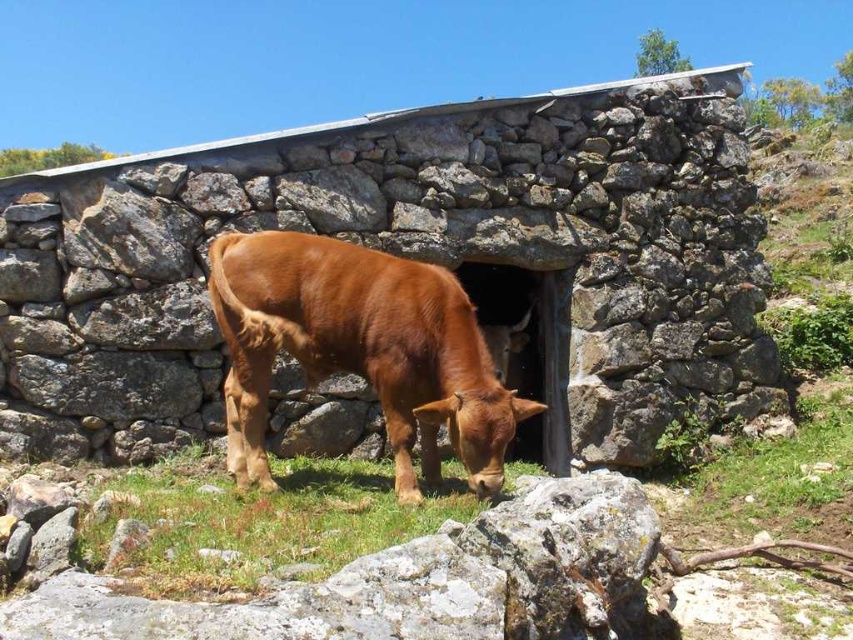
Question: Is brown matte cow at center behind green grass at lower center?

Choices:
 (A) no
 (B) yes

Answer: (B)

Question: Among these points, which one is nearest to the camera?

Choices:
 (A) (456, 417)
 (B) (282, 529)

Answer: (B)

Question: Does brown matte cow at center appear on the right side of green grass at lower center?

Choices:
 (A) no
 (B) yes

Answer: (B)

Question: Which point is farther to the camera?

Choices:
 (A) (148, 508)
 (B) (320, 292)

Answer: (B)

Question: Can you confirm if brown matte cow at center is smaller than green grass at lower center?

Choices:
 (A) no
 (B) yes

Answer: (A)